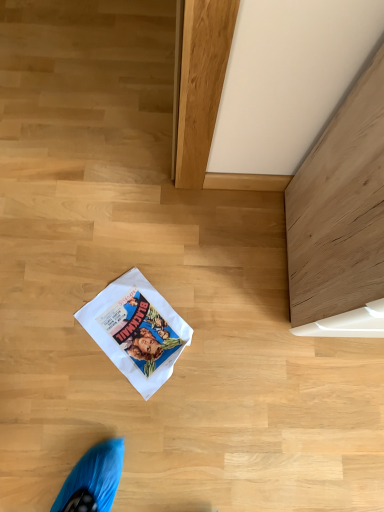
Find the location of `vacant space underneath white paper comic book at center (from a real-world perspective)`. vacant space underneath white paper comic book at center (from a real-world perspective) is located at coordinates (139, 330).